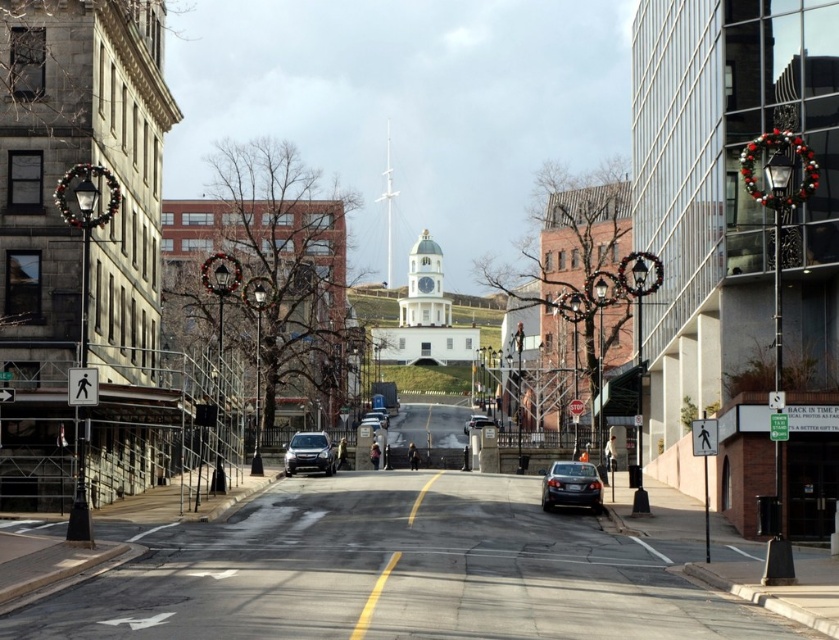
You are standing on the street looking at the historic stone building on the left and the modern glass building on the right. There are two points marked on the image at coordinates point (556, 484) and point (486, 426). Which of these two points is closer to your viewpoint?

Point (556, 484) is closer to the camera than point (486, 426).

You are a pedestrian standing at the crosswalk in the middle of the street. You see a shiny silver sedan at center and a matte black sedan at center. Which car is closer to the right side of the road?

The shiny silver sedan at center is closer to the right side of the road because it is positioned to the right of the matte black sedan at center.